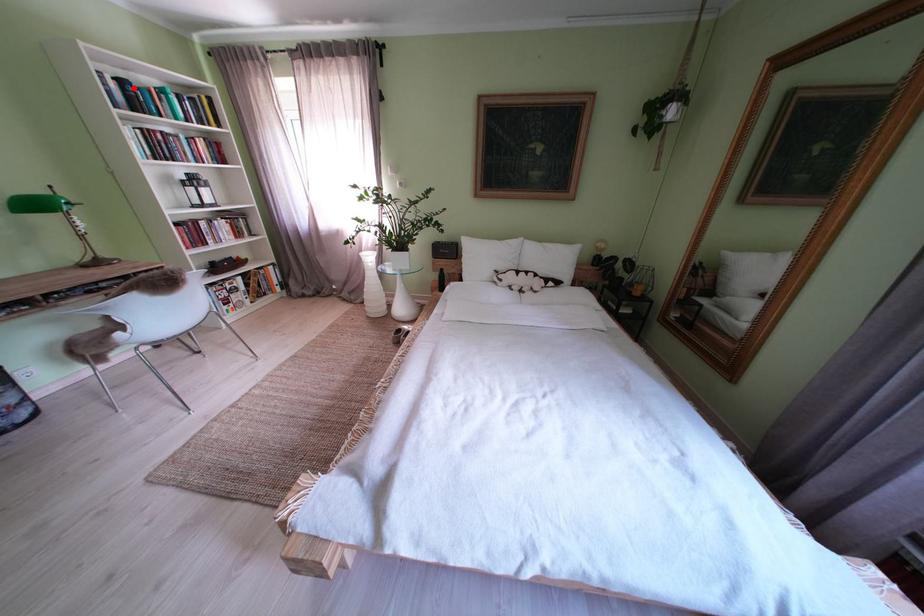
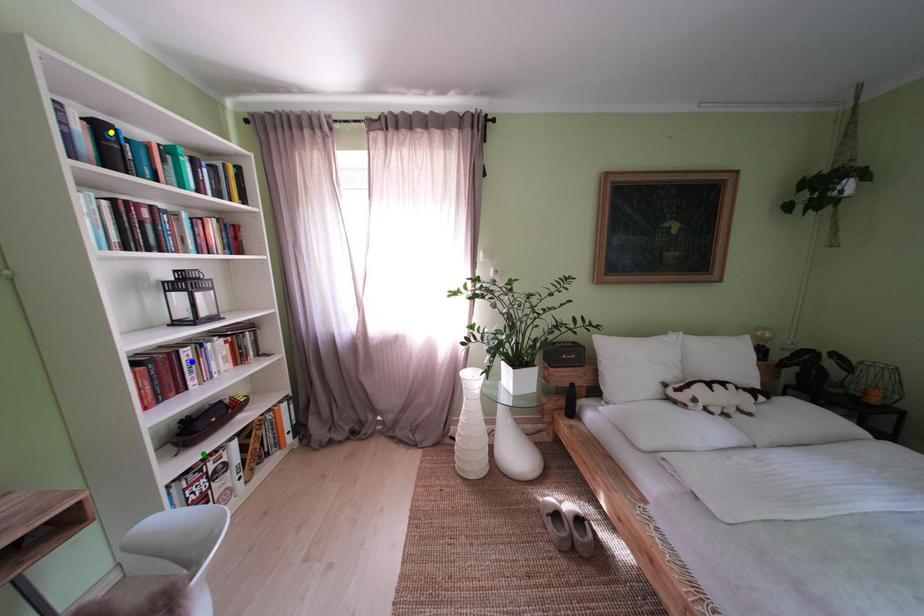
Question: I am providing you with two images of the same scene from different viewpoints. A red point is marked on the first image. You are given multiple points on the second image. Which point in image 2 represents the same 3d spot as the red point in image 1?

Choices:
 (A) green point
 (B) blue point
 (C) yellow point

Answer: (C)